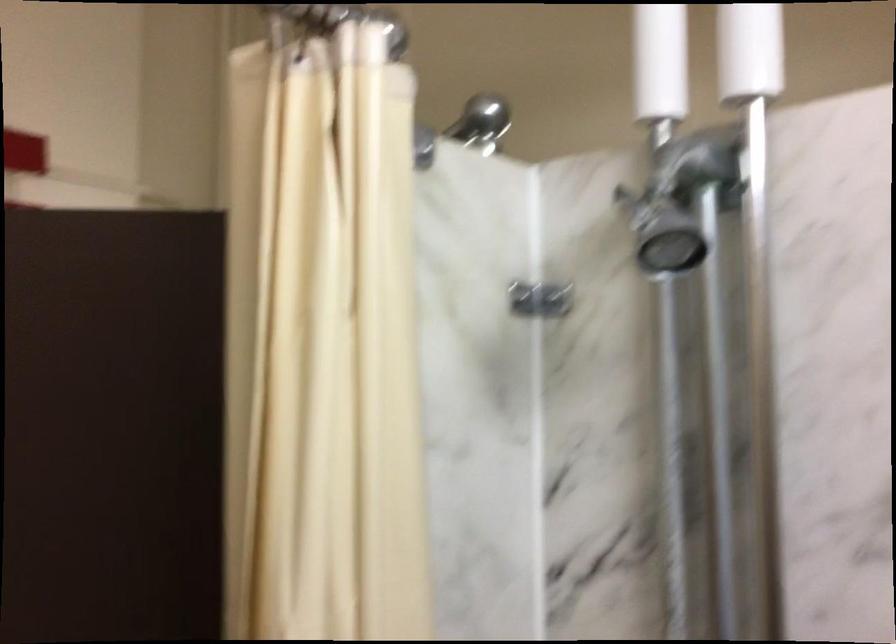
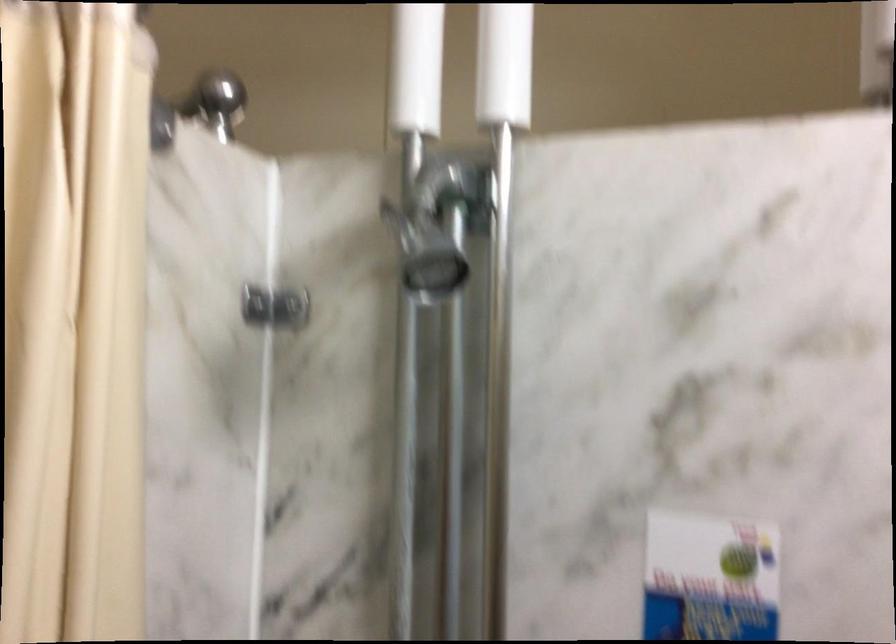
Question: Which direction would the cameraman need to move to produce the second image? Reply with the corresponding letter.

Choices:
 (A) Left
 (B) Right
 (C) Forward
 (D) Backward

Answer: (D)